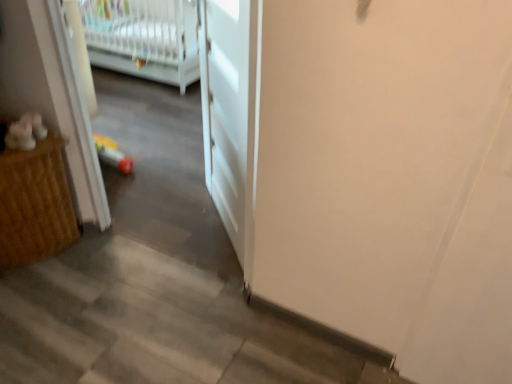
What are the coordinates of `white matte door at center` in the screenshot? It's located at (226, 108).

Is white plastic infant bed at upper left positioned with its back to white matte door at center?

No.

Would you consider white plastic infant bed at upper left to be distant from white matte door at center?

Indeed, white plastic infant bed at upper left is not near white matte door at center.

Is white plastic infant bed at upper left wider than white matte door at center?

Correct, the width of white plastic infant bed at upper left exceeds that of white matte door at center.

Locate an element on the screen. infant bed located behind the white matte door at center is located at coordinates (144, 38).

Which of these two, white matte door at center or white plastic infant bed at upper left, is smaller?

white matte door at center.

Is white matte door at center looking in the opposite direction of white plastic infant bed at upper left?

No, white matte door at center is not facing the opposite direction of white plastic infant bed at upper left.

Considering the relative positions of white matte door at center and white plastic infant bed at upper left in the image provided, is white matte door at center to the left or to the right of white plastic infant bed at upper left?

Clearly, white matte door at center is on the right of white plastic infant bed at upper left in the image.

Who is shorter, wooden cabinet at left or white plastic infant bed at upper left?

With less height is wooden cabinet at left.

Is point (33, 192) farther from viewer compared to point (102, 11)?

No.

From a real-world perspective, who is located higher, wooden cabinet at left or white plastic infant bed at upper left?

white plastic infant bed at upper left.

Locate an element on the screen. This screenshot has height=384, width=512. furniture below the white matte door at center (from a real-world perspective) is located at coordinates (35, 203).

In the scene shown: Considering the sizes of objects white matte door at center and wooden cabinet at left in the image provided, who is thinner, white matte door at center or wooden cabinet at left?

white matte door at center is thinner.

Does white matte door at center have a larger size compared to wooden cabinet at left?

No, white matte door at center is not bigger than wooden cabinet at left.

Considering the positions of point (213, 170) and point (32, 161), is point (213, 170) closer or farther from the camera than point (32, 161)?

Clearly, point (213, 170) is more distant from the camera than point (32, 161).

Could you tell me if white plastic infant bed at upper left is turned towards wooden cabinet at left?

Yes.

Is white plastic infant bed at upper left at the left side of wooden cabinet at left?

Correct, you'll find white plastic infant bed at upper left to the left of wooden cabinet at left.

Is white plastic infant bed at upper left taller or shorter than wooden cabinet at left?

white plastic infant bed at upper left is taller than wooden cabinet at left.

Is wooden cabinet at left aimed at white matte door at center?

No, wooden cabinet at left is not oriented towards white matte door at center.

Between point (53, 200) and point (211, 188), which one is positioned behind?

The point (211, 188) is farther from the camera.

Looking at this image, from the image's perspective, who appears lower, wooden cabinet at left or white matte door at center?

wooden cabinet at left is shown below in the image.

I want to click on infant bed that is under the white matte door at center (from a real-world perspective), so click(144, 38).

Where is `infant bed on the left of the white matte door at center`? infant bed on the left of the white matte door at center is located at coordinates (x=144, y=38).

Estimate the real-world distances between objects in this image. Which object is further from white matte door at center, wooden cabinet at left or white plastic infant bed at upper left?

white plastic infant bed at upper left lies further to white matte door at center than the other object.

Considering their positions, is white matte door at center positioned further to white plastic infant bed at upper left than wooden cabinet at left?

wooden cabinet at left.

When comparing their distances from wooden cabinet at left, does white matte door at center or white plastic infant bed at upper left seem further?

The object further to wooden cabinet at left is white plastic infant bed at upper left.

When comparing their distances from wooden cabinet at left, does white plastic infant bed at upper left or white matte door at center seem closer?

Based on the image, white matte door at center appears to be nearer to wooden cabinet at left.

From the image, which object appears to be nearer to white plastic infant bed at upper left, wooden cabinet at left or white matte door at center?

white matte door at center lies closer to white plastic infant bed at upper left than the other object.

Based on the photo, considering their positions, is white plastic infant bed at upper left positioned further to white matte door at center than wooden cabinet at left?

white plastic infant bed at upper left lies further to white matte door at center than the other object.

Image resolution: width=512 pixels, height=384 pixels. Identify the location of furniture between white matte door at center and white plastic infant bed at upper left from front to back. (35, 203).